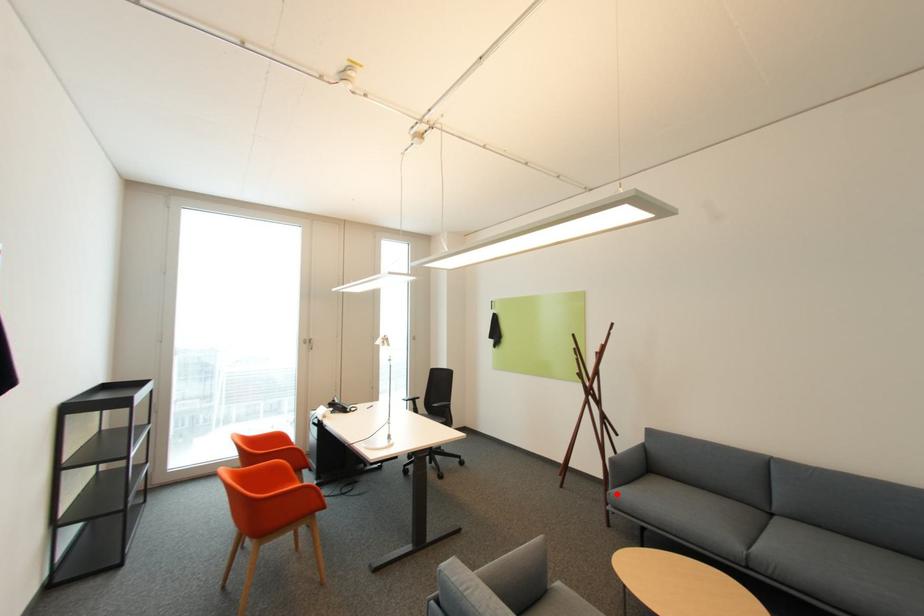
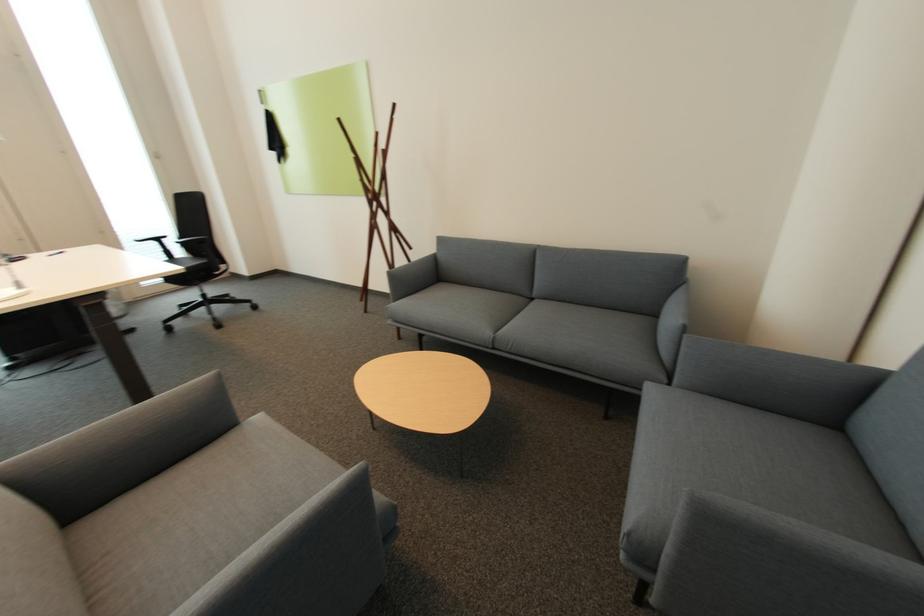
Question: I am providing you with two images of the same scene from different viewpoints. A red point is shown in image1. For the corresponding object point in image2, is it positioned nearer or farther from the camera?

Choices:
 (A) Nearer
 (B) Farther

Answer: (B)